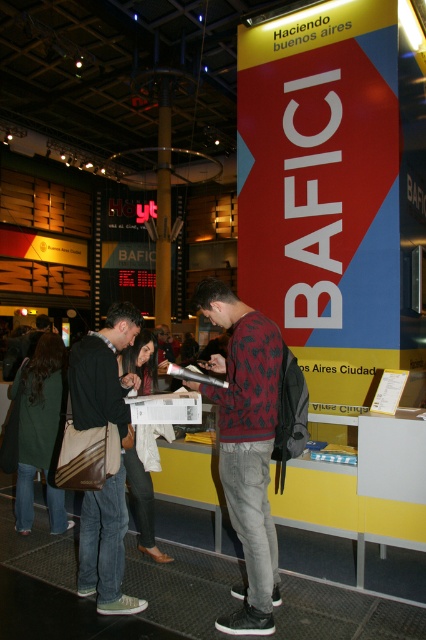
Consider the image. You are at the BAFICI booth and notice two items at the center of the scene. Which item is taller, the khaki canvas bag at center or the white cotton shirt at center?

The khaki canvas bag at center is much taller than the white cotton shirt at center.

You are standing at the convention center and see two points marked in the image. The first point is at coordinate point (273, 598) and the second is at coordinate point (150, 436). Which point is closer to you?

Point (273, 598) is in front of point (150, 436), so the first point is closer to you.